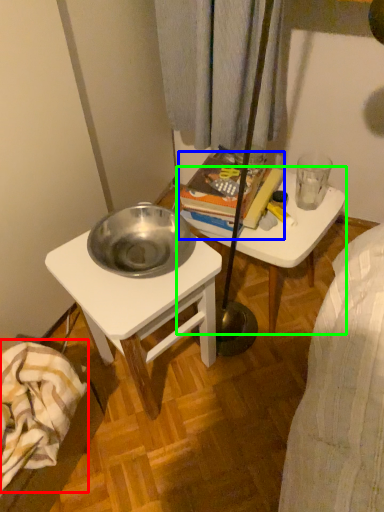
Question: Which object is positioned farthest from blanket (highlighted by a red box)? Select from book (highlighted by a blue box) and table (highlighted by a green box).

Choices:
 (A) book
 (B) table

Answer: (B)